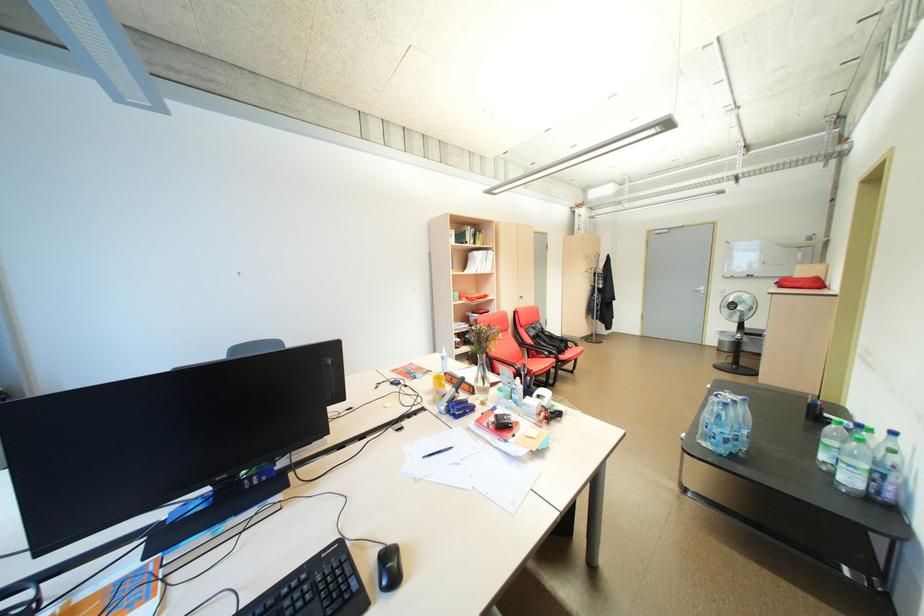
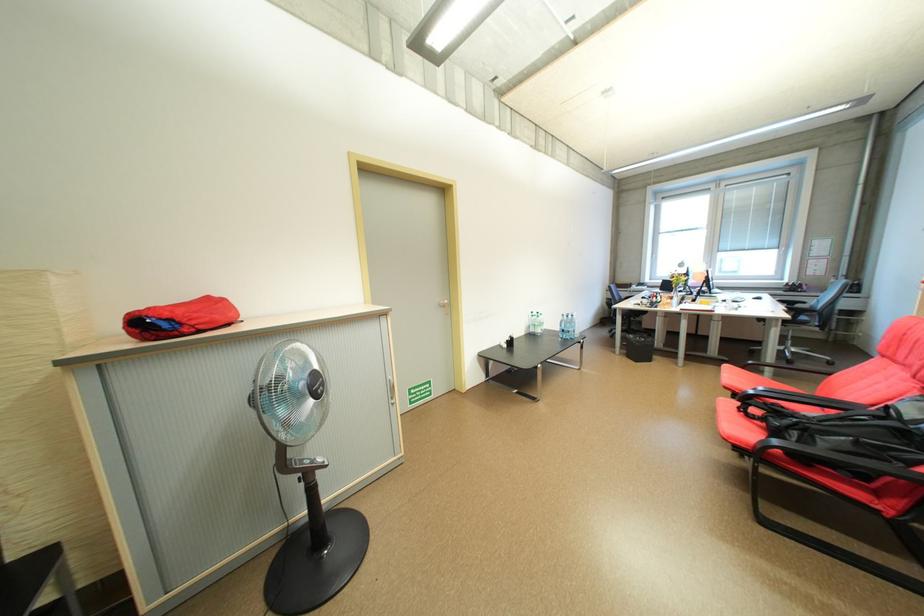
Find the pixel in the second image that matches the point at 552,368 in the first image.

(734, 376)